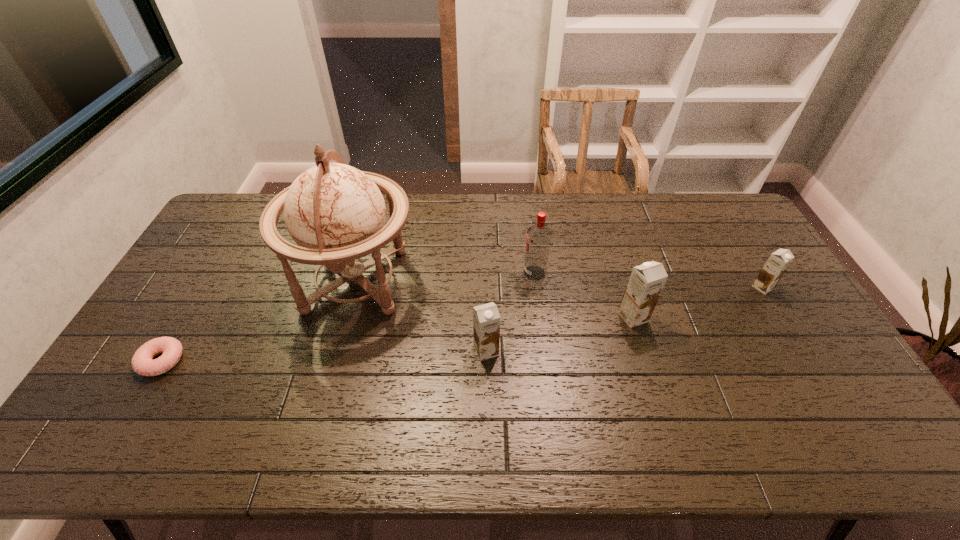
Find the location of a particular element. chocolate milk that stands as the third closest to the doughnut is located at coordinates (778, 262).

Identify which chocolate milk is the second nearest to the globe. Please provide its 2D coordinates. Your answer should be formatted as a tuple, i.e. [(x, y)], where the tuple contains the x and y coordinates of a point satisfying the conditions above.

[(646, 282)]

Where is `free space in the image that satisfies the following two spatial constraints: 1. on the front label of the rightmost chocolate milk; 2. on the right side of the third object from right to left`? free space in the image that satisfies the following two spatial constraints: 1. on the front label of the rightmost chocolate milk; 2. on the right side of the third object from right to left is located at coordinates (537, 287).

Locate an element on the screen. The image size is (960, 540). vacant space that satisfies the following two spatial constraints: 1. on the front-facing side of the fifth object from right to left; 2. on the back side of the leftmost chocolate milk is located at coordinates (337, 350).

In order to click on free space that satisfies the following two spatial constraints: 1. on the front-facing side of the second object from left to right; 2. on the left side of the rightmost object in this screenshot , I will do `click(354, 287)`.

Where is `vacant area that satisfies the following two spatial constraints: 1. on the front-facing side of the globe; 2. on the back side of the third object from left to right`? Image resolution: width=960 pixels, height=540 pixels. vacant area that satisfies the following two spatial constraints: 1. on the front-facing side of the globe; 2. on the back side of the third object from left to right is located at coordinates (337, 350).

Where is `vacant space that satisfies the following two spatial constraints: 1. on the front-facing side of the tallest object; 2. on the right side of the third shortest object`? The height and width of the screenshot is (540, 960). vacant space that satisfies the following two spatial constraints: 1. on the front-facing side of the tallest object; 2. on the right side of the third shortest object is located at coordinates (337, 350).

Identify the location of vacant area that satisfies the following two spatial constraints: 1. on the front-facing side of the globe; 2. on the right side of the nearest chocolate milk. (337, 350).